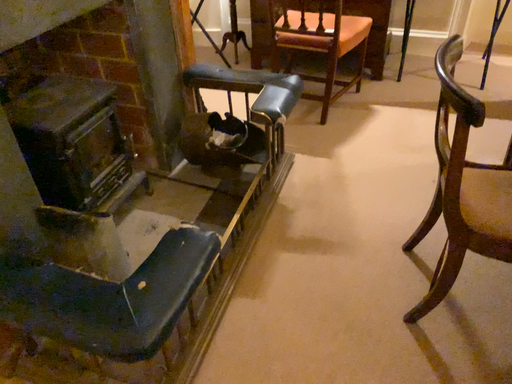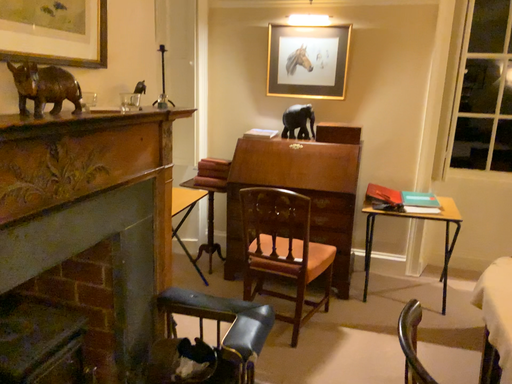
Question: Which way did the camera rotate in the video?

Choices:
 (A) rotated downward
 (B) rotated upward

Answer: (B)